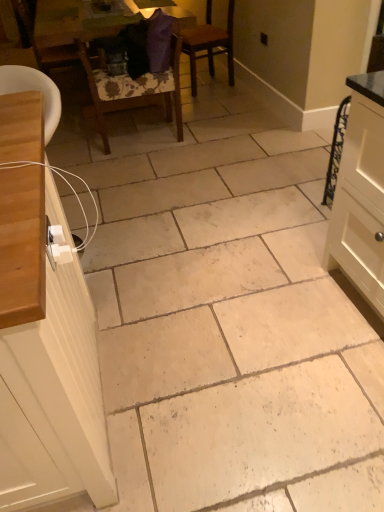
At what (x,y) coordinates should I click in order to perform the action: click on wooden chair at center, the 2th chair in the left-to-right sequence. Please return your answer as a coordinate pair (x, y). Looking at the image, I should click on (135, 88).

Locate an element on the screen. wooden table at upper center is located at coordinates (78, 25).

Considering the relative positions of white matte cabinet at left and wooden table at upper center in the image provided, is white matte cabinet at left to the right of wooden table at upper center from the viewer's perspective?

Indeed, white matte cabinet at left is positioned on the right side of wooden table at upper center.

Measure the distance from white matte cabinet at left to wooden table at upper center.

The distance of white matte cabinet at left from wooden table at upper center is 2.32 meters.

Where is `table on the left of white matte cabinet at left`? Image resolution: width=384 pixels, height=512 pixels. table on the left of white matte cabinet at left is located at coordinates (78, 25).

Is white matte cabinet at left situated inside wooden table at upper center or outside?

white matte cabinet at left cannot be found inside wooden table at upper center.

From the image's perspective, is wooden chair at left, which appears as the 1th chair when viewed from the left, below wooden table at upper center?

Yes, from the image's perspective, wooden chair at left, which appears as the 1th chair when viewed from the left, is below wooden table at upper center.

Consider the image. Is wooden chair at left, which appears as the 1th chair when viewed from the left, positioned behind wooden table at upper center?

Yes, wooden chair at left, which appears as the 1th chair when viewed from the left, is further from the camera.

Is wooden chair at left, which is the third chair in right-to-left order, aimed at wooden table at upper center?

Yes, wooden chair at left, which is the third chair in right-to-left order, is aimed at wooden table at upper center.

Looking at this image, from a real-world perspective, between wooden chair at left, which is the third chair in right-to-left order, and wooden table at upper center, who is vertically lower?

wooden table at upper center is physically lower.

Is the depth of wooden chair at center, the 2th chair in the left-to-right sequence, greater than that of white matte cabinet at left?

Yes, it is.

Would you say white matte cabinet at left is part of wooden chair at center, the 2th chair in the left-to-right sequence,'s contents?

Actually, white matte cabinet at left is outside wooden chair at center, the 2th chair in the left-to-right sequence.

Which is farther, (x=129, y=89) or (x=71, y=240)?

The point (x=129, y=89) is behind.

Considering the relative sizes of wooden chair at center, the 2th chair in the left-to-right sequence, and white matte cabinet at left in the image provided, is wooden chair at center, the 2th chair in the left-to-right sequence, bigger than white matte cabinet at left?

No, wooden chair at center, the 2th chair in the left-to-right sequence, is not bigger than white matte cabinet at left.

Is brown wooden chair at center, arranged as the first chair when viewed from the right, turned away from white matte cabinet at left?

brown wooden chair at center, arranged as the first chair when viewed from the right, does not have its back to white matte cabinet at left.

Considering the sizes of brown wooden chair at center, which is the third chair from left to right, and white matte cabinet at left in the image, is brown wooden chair at center, which is the third chair from left to right, taller or shorter than white matte cabinet at left?

In the image, brown wooden chair at center, which is the third chair from left to right, appears to be shorter than white matte cabinet at left.

Which is correct: brown wooden chair at center, which is the third chair from left to right, is inside white matte cabinet at left, or outside of it?

brown wooden chair at center, which is the third chair from left to right, is not enclosed by white matte cabinet at left.

Which object is further away from the camera, brown wooden chair at center, arranged as the first chair when viewed from the right, or white matte cabinet at left?

brown wooden chair at center, arranged as the first chair when viewed from the right, is more distant.

Considering the relative sizes of wooden table at upper center and white matte cabinet at left in the image provided, is wooden table at upper center taller than white matte cabinet at left?

No.

Can you tell me how much wooden table at upper center and white matte cabinet at left differ in facing direction?

The facing directions of wooden table at upper center and white matte cabinet at left are 179 degrees apart.

From a real-world perspective, which object stands above the other?

From a 3D spatial view, white matte cabinet at left is above.

Does wooden table at upper center turn towards white matte cabinet at left?

Yes, wooden table at upper center is aimed at white matte cabinet at left.

Would you say wooden chair at center, the 2th chair in the left-to-right sequence, contains brown wooden chair at center, which is the third chair from left to right?

No, brown wooden chair at center, which is the third chair from left to right, is located outside of wooden chair at center, the 2th chair in the left-to-right sequence.

How many degrees apart are the facing directions of wooden chair at center, which is counted as the second chair, starting from the right, and brown wooden chair at center, which is the third chair from left to right?

The facing directions of wooden chair at center, which is counted as the second chair, starting from the right, and brown wooden chair at center, which is the third chair from left to right, are 102 degrees apart.

Which object is wider, wooden chair at center, which is counted as the second chair, starting from the right, or brown wooden chair at center, which is the third chair from left to right?

brown wooden chair at center, which is the third chair from left to right.

Is wooden chair at center, which is counted as the second chair, starting from the right, oriented away from brown wooden chair at center, arranged as the first chair when viewed from the right?

wooden chair at center, which is counted as the second chair, starting from the right, does not have its back to brown wooden chair at center, arranged as the first chair when viewed from the right.

Is brown wooden chair at center, which is the third chair from left to right, further to the viewer compared to wooden chair at center, which is counted as the second chair, starting from the right?

Yes, brown wooden chair at center, which is the third chair from left to right, is further from the viewer.

Is brown wooden chair at center, which is the third chair from left to right, placed right next to wooden chair at center, which is counted as the second chair, starting from the right?

brown wooden chair at center, which is the third chair from left to right, and wooden chair at center, which is counted as the second chair, starting from the right, are clearly separated.

This screenshot has width=384, height=512. I want to click on chair below the brown wooden chair at center, arranged as the first chair when viewed from the right (from a real-world perspective), so click(x=135, y=88).

Can you confirm if brown wooden chair at center, which is the third chair from left to right, is thinner than wooden chair at center, the 2th chair in the left-to-right sequence?

No.

You are a GUI agent. You are given a task and a screenshot of the screen. Output one action in this format:
    pyautogui.click(x=<x>, y=<y>)
    Task: Click on the cabinetry positioned vertically above the wooden table at upper center (from a real-world perspective)
    The height and width of the screenshot is (512, 384).
    Given the screenshot: What is the action you would take?
    pyautogui.click(x=50, y=334)

Where is `chair that is the 2nd one when counting downward from the wooden table at upper center (from the image's perspective)`? The height and width of the screenshot is (512, 384). chair that is the 2nd one when counting downward from the wooden table at upper center (from the image's perspective) is located at coordinates (51, 31).

Looking at this image, from the image, which object appears to be farther from brown wooden chair at center, arranged as the first chair when viewed from the right, wooden chair at center, the 2th chair in the left-to-right sequence, or white matte cabinet at left?

The object further to brown wooden chair at center, arranged as the first chair when viewed from the right, is white matte cabinet at left.

Considering their positions, is brown wooden chair at center, arranged as the first chair when viewed from the right, positioned further to wooden chair at left, which is the third chair in right-to-left order, than wooden chair at center, which is counted as the second chair, starting from the right?

brown wooden chair at center, arranged as the first chair when viewed from the right, lies further to wooden chair at left, which is the third chair in right-to-left order, than the other object.

Considering their positions, is wooden chair at center, which is counted as the second chair, starting from the right, positioned closer to wooden chair at left, which is the third chair in right-to-left order, than brown wooden chair at center, arranged as the first chair when viewed from the right?

The object closer to wooden chair at left, which is the third chair in right-to-left order, is wooden chair at center, which is counted as the second chair, starting from the right.

Considering their positions, is wooden chair at left, which appears as the 1th chair when viewed from the left, positioned further to wooden table at upper center than brown wooden chair at center, which is the third chair from left to right?

brown wooden chair at center, which is the third chair from left to right, is positioned further to the anchor wooden table at upper center.

Estimate the real-world distances between objects in this image. Which object is closer to brown wooden chair at center, which is the third chair from left to right, white matte cabinet at left or wooden chair at left, which appears as the 1th chair when viewed from the left?

Based on the image, wooden chair at left, which appears as the 1th chair when viewed from the left, appears to be nearer to brown wooden chair at center, which is the third chair from left to right.

From the image, which object appears to be farther from wooden chair at center, the 2th chair in the left-to-right sequence, wooden chair at left, which is the third chair in right-to-left order, or brown wooden chair at center, arranged as the first chair when viewed from the right?

Among the two, brown wooden chair at center, arranged as the first chair when viewed from the right, is located further to wooden chair at center, the 2th chair in the left-to-right sequence.

Looking at the image, which one is located further to white matte cabinet at left, brown wooden chair at center, which is the third chair from left to right, or wooden table at upper center?

brown wooden chair at center, which is the third chair from left to right, is further to white matte cabinet at left.

Estimate the real-world distances between objects in this image. Which object is further from white matte cabinet at left, wooden chair at center, which is counted as the second chair, starting from the right, or wooden chair at left, which appears as the 1th chair when viewed from the left?

wooden chair at left, which appears as the 1th chair when viewed from the left, lies further to white matte cabinet at left than the other object.

The height and width of the screenshot is (512, 384). Find the location of `chair located between white matte cabinet at left and wooden table at upper center in the depth direction`. chair located between white matte cabinet at left and wooden table at upper center in the depth direction is located at coordinates (135, 88).

Where is `table located between white matte cabinet at left and brown wooden chair at center, which is the third chair from left to right, in the depth direction`? Image resolution: width=384 pixels, height=512 pixels. table located between white matte cabinet at left and brown wooden chair at center, which is the third chair from left to right, in the depth direction is located at coordinates (78, 25).

Where is `chair positioned between white matte cabinet at left and wooden chair at left, which is the third chair in right-to-left order, from near to far`? The image size is (384, 512). chair positioned between white matte cabinet at left and wooden chair at left, which is the third chair in right-to-left order, from near to far is located at coordinates (135, 88).

This screenshot has width=384, height=512. Find the location of `chair between wooden chair at left, which is the third chair in right-to-left order, and brown wooden chair at center, arranged as the first chair when viewed from the right, in the horizontal direction`. chair between wooden chair at left, which is the third chair in right-to-left order, and brown wooden chair at center, arranged as the first chair when viewed from the right, in the horizontal direction is located at coordinates (135, 88).